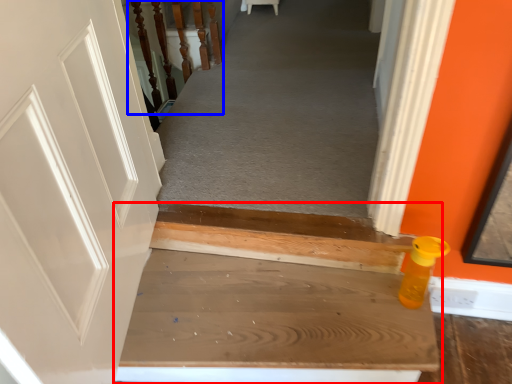
Question: Which object is closer to the camera taking this photo, stairs (highlighted by a red box) or rail (highlighted by a blue box)?

Choices:
 (A) stairs
 (B) rail

Answer: (A)